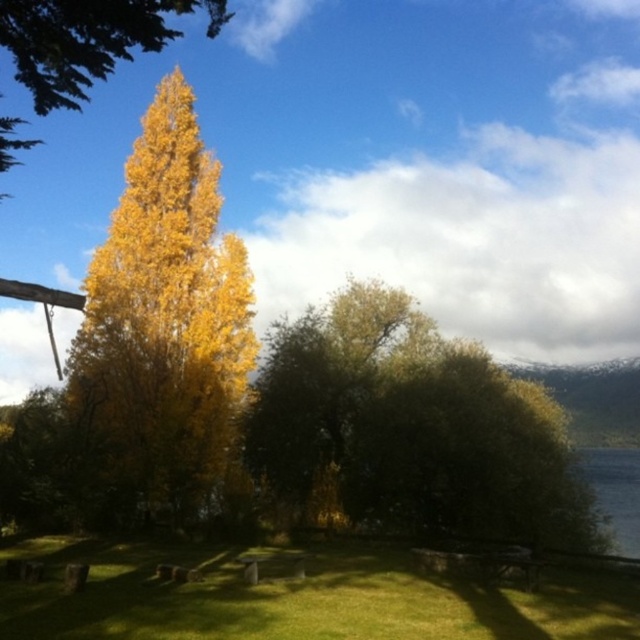
Based on the photo, is golden yellow leaves at center wider than golden yellow leaves at upper left?

No, golden yellow leaves at center is not wider than golden yellow leaves at upper left.

From the picture: Is golden yellow leaves at center to the left of golden yellow leaves at upper left from the viewer's perspective?

In fact, golden yellow leaves at center is to the right of golden yellow leaves at upper left.

In order to click on golden yellow leaves at center in this screenshot , I will do `click(161, 328)`.

What do you see at coordinates (412, 429) in the screenshot? This screenshot has width=640, height=640. I see `green leafy tree at center` at bounding box center [412, 429].

The width and height of the screenshot is (640, 640). What do you see at coordinates (412, 429) in the screenshot?
I see `green leafy tree at center` at bounding box center [412, 429].

Identify the location of green leafy tree at center. The image size is (640, 640). (412, 429).

Is green leafy tree at center shorter than golden yellow leaves at upper left?

Indeed, green leafy tree at center has a lesser height compared to golden yellow leaves at upper left.

Is point (444, 429) in front of point (104, 49)?

No.

Between point (280, 461) and point (104, 65), which one is positioned behind?

The point (280, 461) is more distant.

Identify the location of green leafy tree at center. click(412, 429).